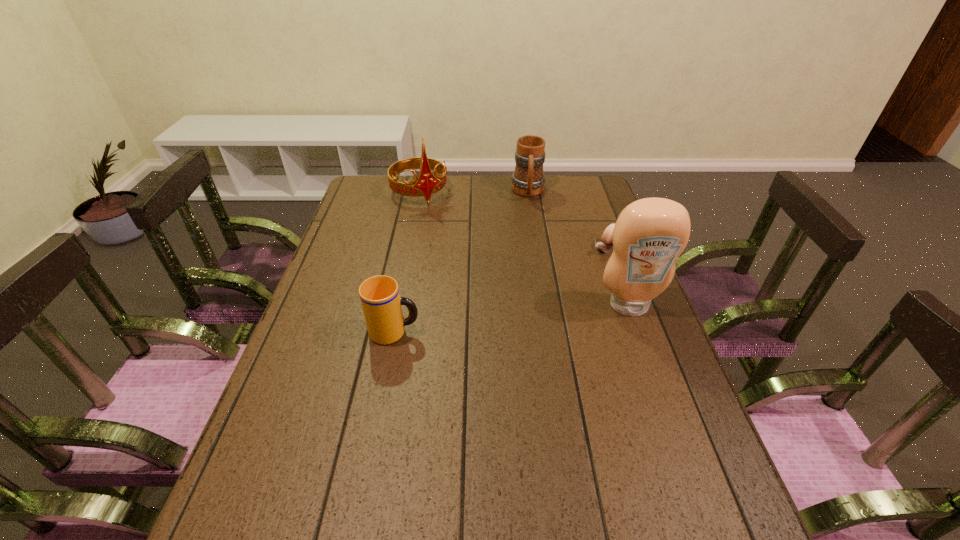
This screenshot has width=960, height=540. Identify the location of the second shortest object. (380, 298).

The height and width of the screenshot is (540, 960). In order to click on condiment in this screenshot , I will do `click(649, 235)`.

At what (x,y) coordinates should I click in order to perform the action: click on the third tallest object. Please return your answer as a coordinate pair (x, y). This screenshot has height=540, width=960. Looking at the image, I should click on (528, 180).

The height and width of the screenshot is (540, 960). In order to click on the third object from left to right in this screenshot , I will do `click(528, 180)`.

Locate an element on the screen. This screenshot has width=960, height=540. escargot is located at coordinates tap(606, 245).

The height and width of the screenshot is (540, 960). Identify the location of the third farthest object. (606, 245).

Find the location of a particular element. tiara is located at coordinates (427, 183).

Locate an element on the screen. The image size is (960, 540). vacant space located on the side of the cup with the handle is located at coordinates (491, 332).

Locate an element on the screen. The image size is (960, 540). blank space located on the label of the condiment is located at coordinates (640, 336).

This screenshot has width=960, height=540. I want to click on vacant space located on the side of the mug with the handle, so click(x=531, y=227).